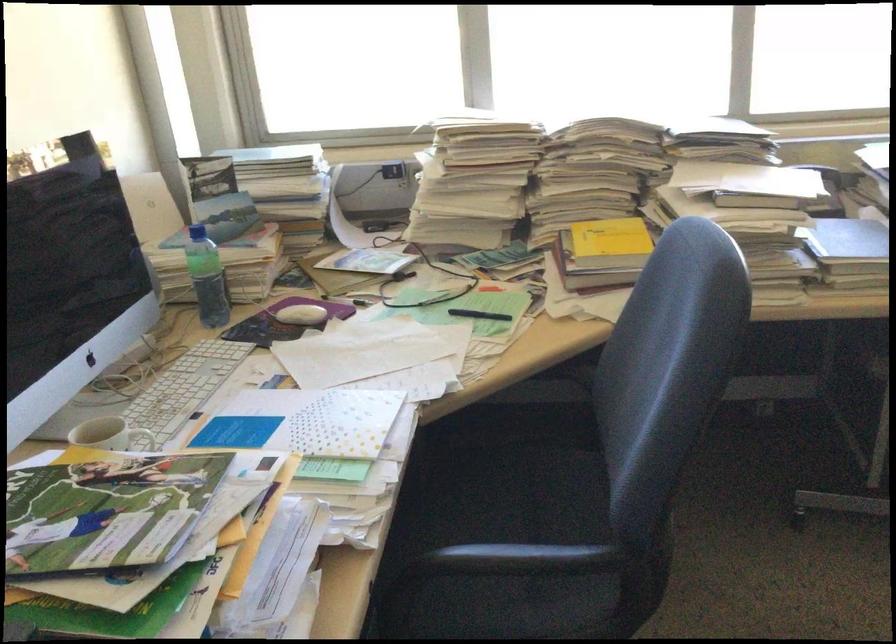
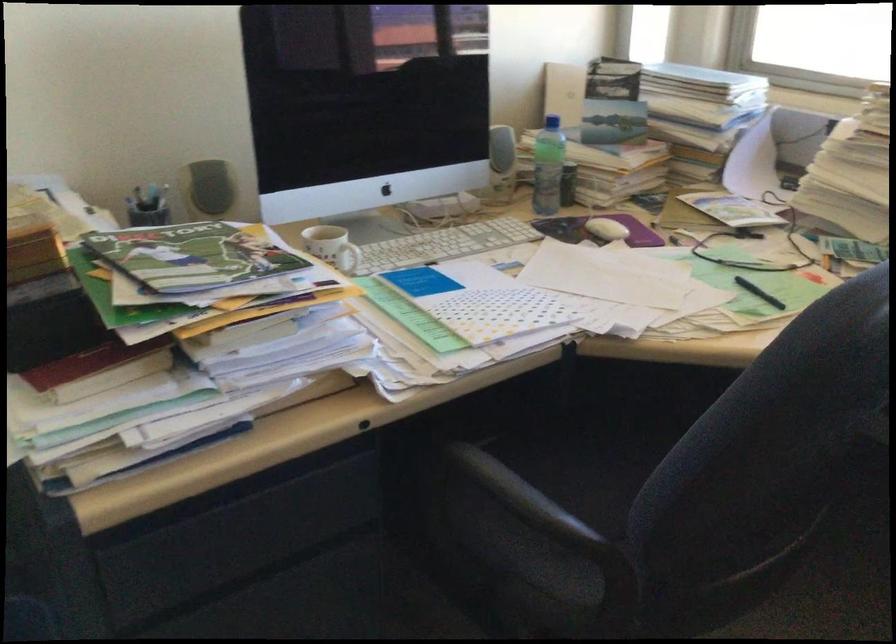
The point at (311, 315) is marked in the first image. Where is the corresponding point in the second image?

(606, 229)